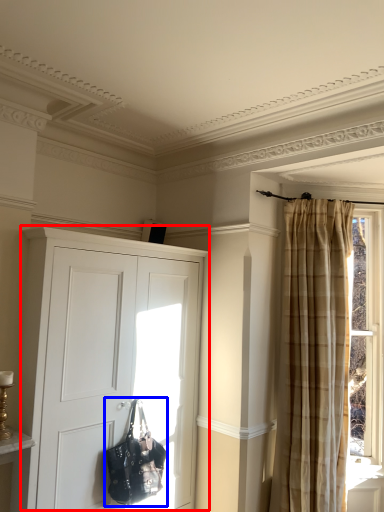
Question: Which point is closer to the camera, cupboard (highlighted by a red box) or handbag (highlighted by a blue box)?

Choices:
 (A) cupboard
 (B) handbag

Answer: (A)